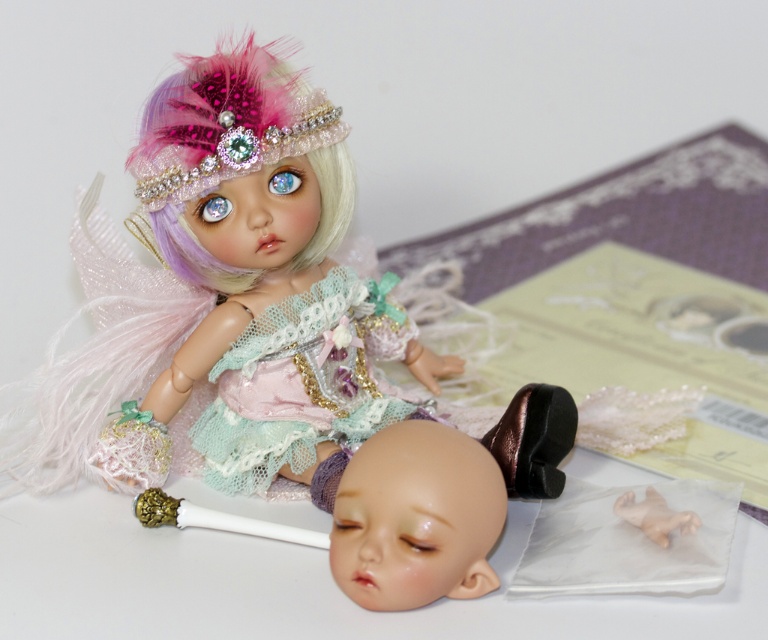
You are an artist trying to sketch the scene. You notice the matte pink fabric doll at upper left and the pastel pink feathered hair at upper left. Which object is closer to the bottom of the image?

The matte pink fabric doll at upper left is positioned under the pastel pink feathered hair at upper left, so the doll is closer to the bottom of the image.

You are a toy designer who wants to place the matte pink fabric doll at upper left and the pastel pink feathered hair at upper left on a display shelf. The shelf has a width of 6 inches. Can both items fit side by side without overlapping?

The matte pink fabric doll at upper left is 5.51 inches away from the pastel pink feathered hair at upper left. Since the total distance between them is less than the shelf width of 6 inches, both items can fit side by side on the shelf without overlapping.